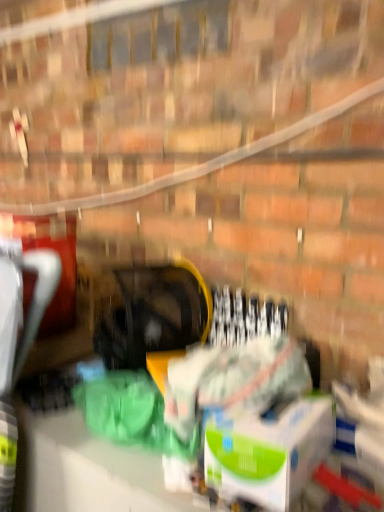
This screenshot has height=512, width=384. I want to click on white matte tissue box at center, so click(x=270, y=452).

Describe the element at coordinates (270, 452) in the screenshot. I see `white matte tissue box at center` at that location.

Where is `white matte tissue box at center`? Image resolution: width=384 pixels, height=512 pixels. white matte tissue box at center is located at coordinates (270, 452).